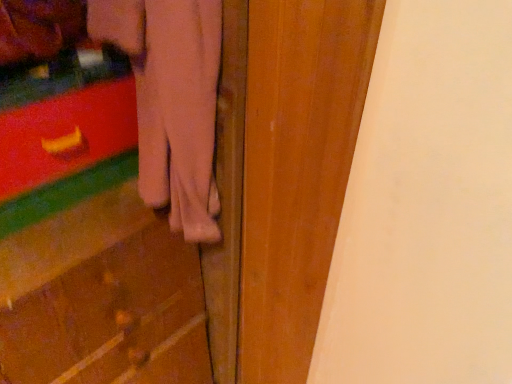
This screenshot has width=512, height=384. Identify the location of matte plastic drawer at lower left. (113, 319).

This screenshot has height=384, width=512. Describe the element at coordinates (113, 319) in the screenshot. I see `matte plastic drawer at lower left` at that location.

The width and height of the screenshot is (512, 384). I want to click on matte plastic drawer at lower left, so click(x=113, y=319).